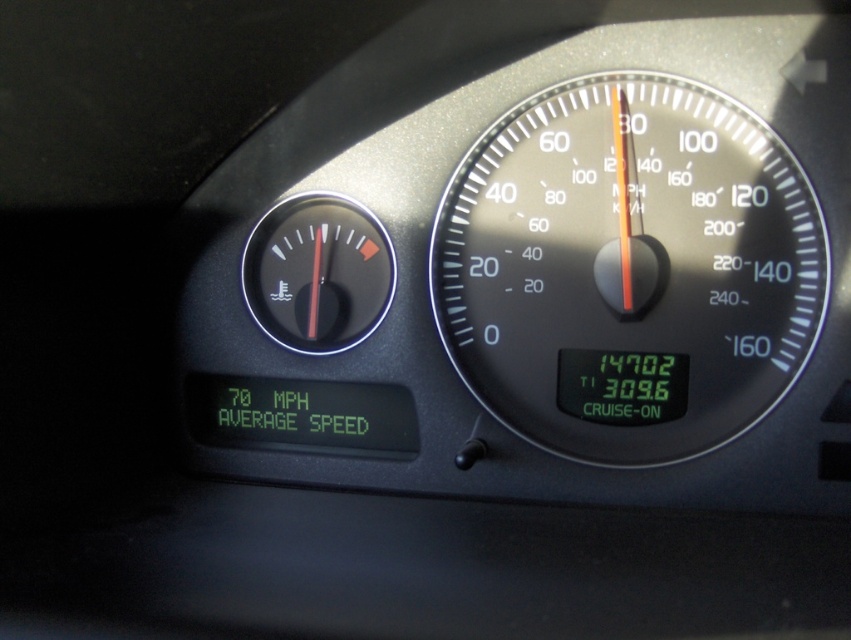
Is black plastic speedometer at center in front of black plastic gauge at center?

Yes, black plastic speedometer at center is in front of black plastic gauge at center.

Does black plastic speedometer at center appear on the right side of black plastic gauge at center?

Yes, black plastic speedometer at center is to the right of black plastic gauge at center.

Who is more forward, (x=544, y=134) or (x=335, y=216)?

Positioned in front is point (x=544, y=134).

Find the location of `black plastic speedometer at center`. black plastic speedometer at center is located at coordinates (629, 268).